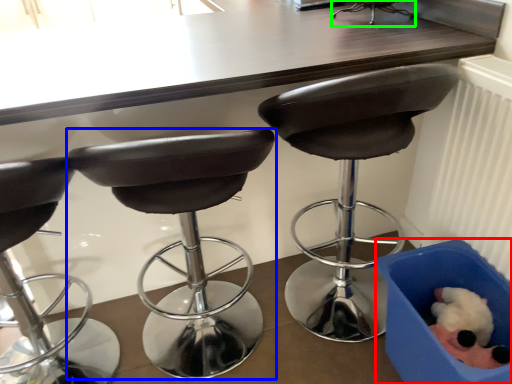
Question: Considering the real-world distances, which object is closest to box (highlighted by a red box)? chair (highlighted by a blue box) or chair (highlighted by a green box).

Choices:
 (A) chair
 (B) chair

Answer: (A)